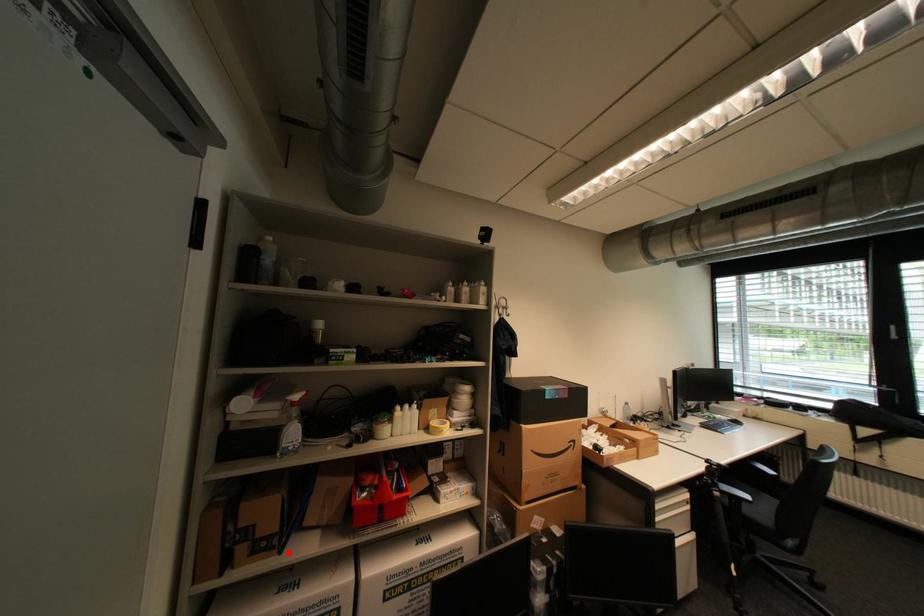
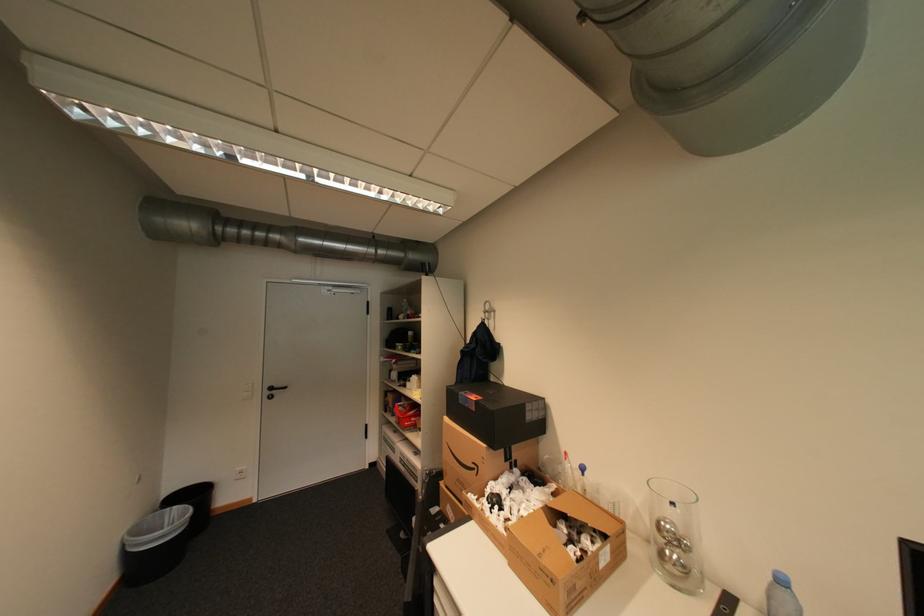
Question: I am providing you with two images of the same scene from different viewpoints. In image1, a red point is highlighted. Considering the same 3D point in image2, which of the following is correct?

Choices:
 (A) It is closer
 (B) It is farther

Answer: (B)